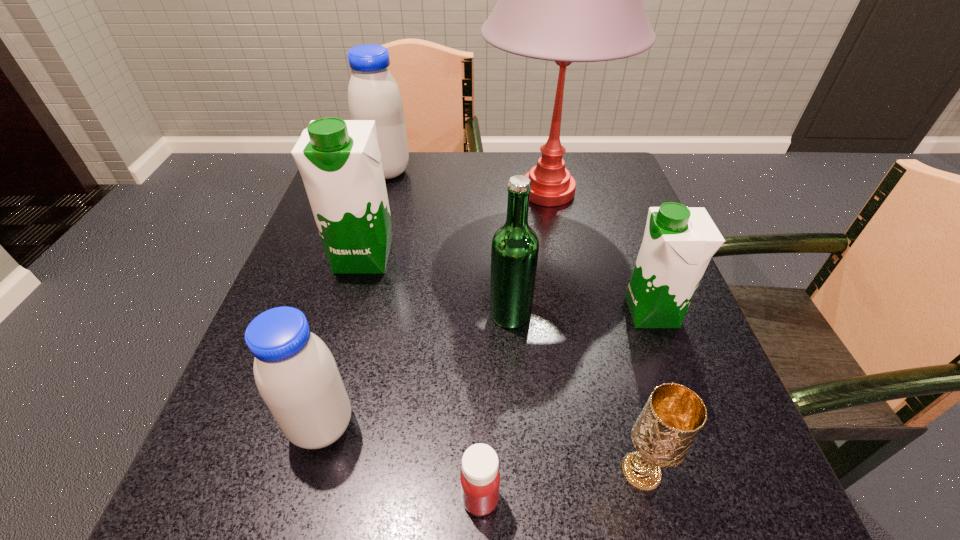
Locate an element on the screen. The image size is (960, 540). the tallest object is located at coordinates [566, 0].

Find the location of `table lamp`. table lamp is located at coordinates (566, 0).

Locate an element on the screen. The width and height of the screenshot is (960, 540). the left green soya milk is located at coordinates (339, 160).

Locate an element on the screen. This screenshot has width=960, height=540. the bigger green soya milk is located at coordinates (339, 160).

This screenshot has width=960, height=540. I want to click on the bigger blue soya milk, so click(373, 94).

At what (x,y) coordinates should I click in order to perform the action: click on the farther blue soya milk. Please return your answer as a coordinate pair (x, y). The image size is (960, 540). Looking at the image, I should click on (373, 94).

Locate an element on the screen. beer bottle is located at coordinates (515, 246).

The image size is (960, 540). In order to click on the smaller green soya milk in this screenshot , I will do `click(678, 243)`.

Identify the location of the right green soya milk. (678, 243).

Locate an element on the screen. the nearer blue soya milk is located at coordinates (296, 374).